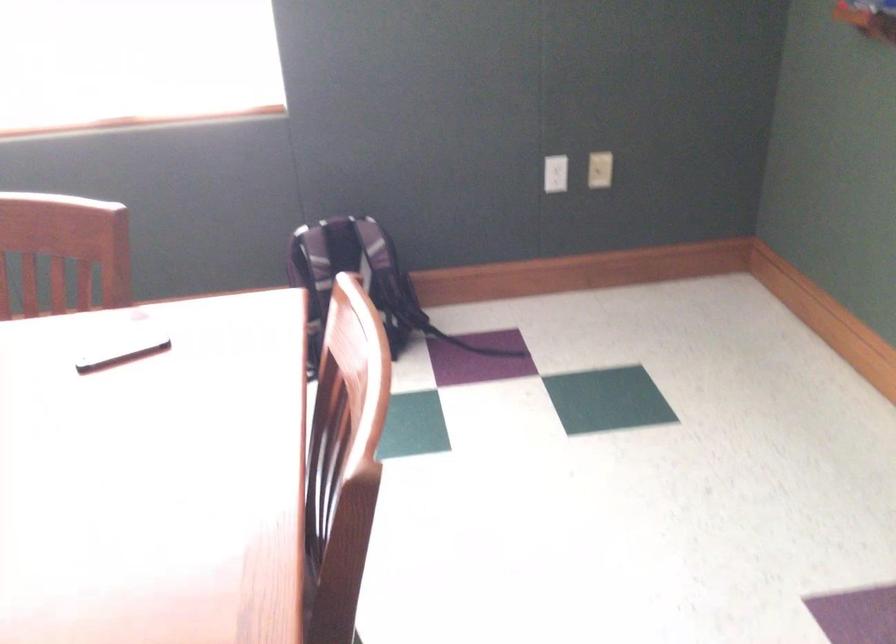
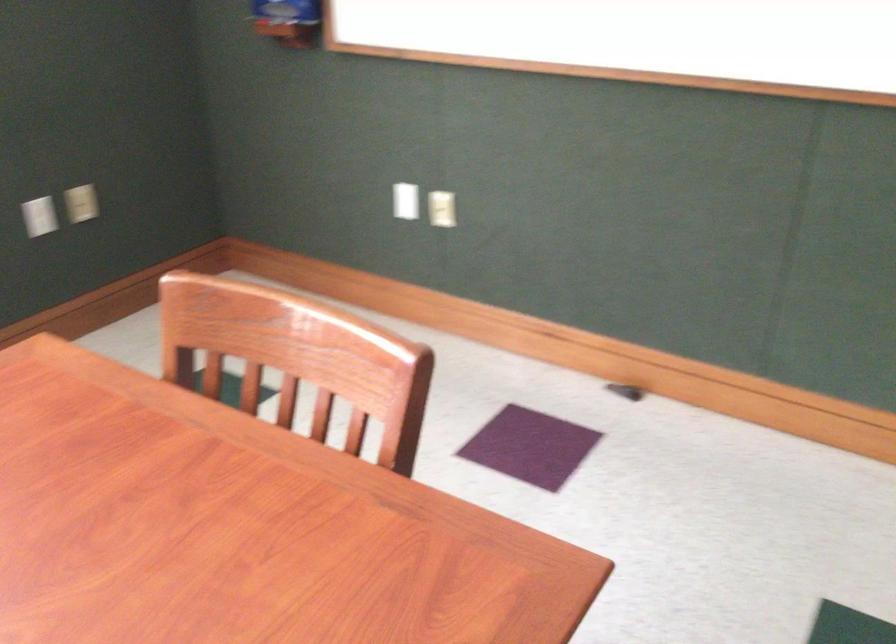
Question: How did the camera likely rotate?

Choices:
 (A) Left
 (B) Right
 (C) Up
 (D) Down

Answer: (B)